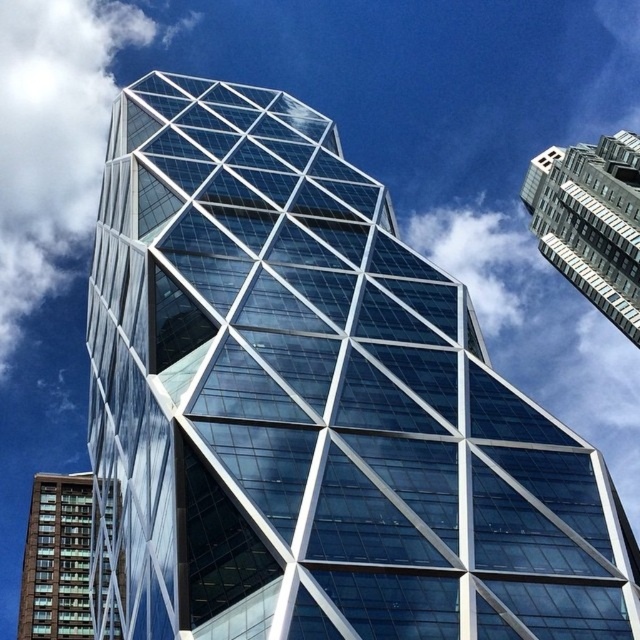
Question: Is glassy steel skyscraper at upper right to the right of green glass building at lower left from the viewer's perspective?

Choices:
 (A) yes
 (B) no

Answer: (A)

Question: Is white fluffy cloud at upper left above green glass building at lower left?

Choices:
 (A) no
 (B) yes

Answer: (B)

Question: Which of the following is the farthest from the observer?

Choices:
 (A) white fluffy cloud at upper left
 (B) glassy steel skyscraper at upper right

Answer: (A)

Question: Estimate the real-world distances between objects in this image. Which object is closer to the glassy steel skyscraper at upper right?

Choices:
 (A) white fluffy cloud at upper left
 (B) green glass building at lower left

Answer: (B)

Question: Which point is farther to the camera?

Choices:
 (A) (83, 499)
 (B) (602, 204)

Answer: (A)

Question: Where is white fluffy cloud at upper left located in relation to green glass building at lower left in the image?

Choices:
 (A) left
 (B) right

Answer: (A)